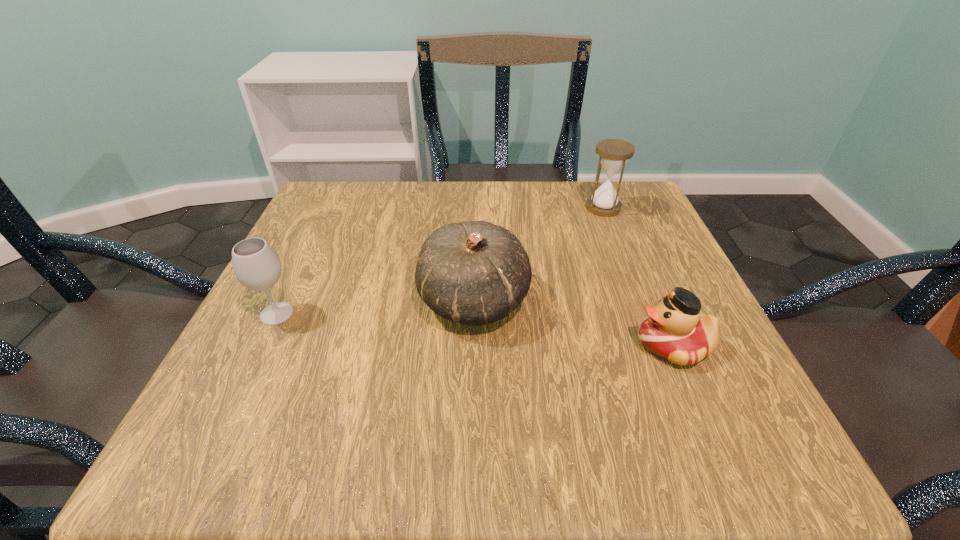
Find the location of a particular element. unoccupied area between the duck and the farthest object is located at coordinates (638, 276).

Choose which object is the second nearest neighbor to the gourd. Please provide its 2D coordinates. Your answer should be formatted as a tuple, i.e. [(x, y)], where the tuple contains the x and y coordinates of a point satisfying the conditions above.

[(256, 265)]

Identify which object is located as the third nearest to the gourd. Please provide its 2D coordinates. Your answer should be formatted as a tuple, i.e. [(x, y)], where the tuple contains the x and y coordinates of a point satisfying the conditions above.

[(613, 154)]

Locate an element on the screen. This screenshot has height=540, width=960. free location that satisfies the following two spatial constraints: 1. on the back side of the gourd; 2. on the left side of the leftmost object is located at coordinates 283,300.

The image size is (960, 540). I want to click on vacant space that satisfies the following two spatial constraints: 1. on the back side of the farthest object; 2. on the right side of the third object from right to left, so click(x=475, y=208).